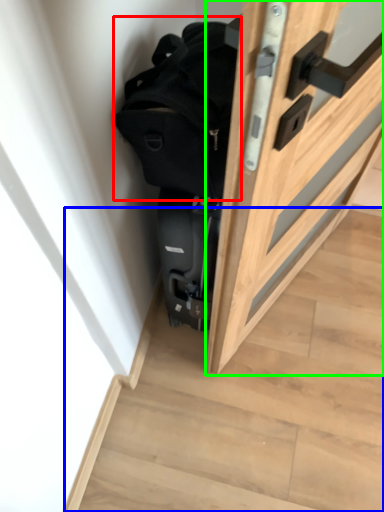
Question: Considering the real-world distances, which object is closest to backpack (highlighted by a red box)? stairwell (highlighted by a blue box) or door (highlighted by a green box).

Choices:
 (A) stairwell
 (B) door

Answer: (B)